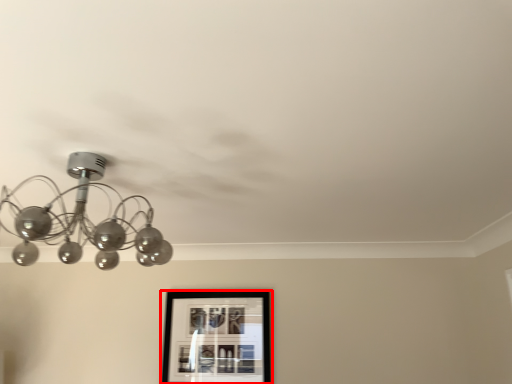
Question: From the image's perspective, considering the relative positions of picture frame (annotated by the red box) and lamp in the image provided, where is picture frame (annotated by the red box) located with respect to the staircase?

Choices:
 (A) above
 (B) below

Answer: (B)